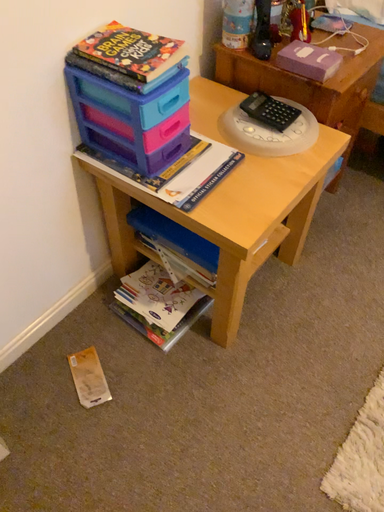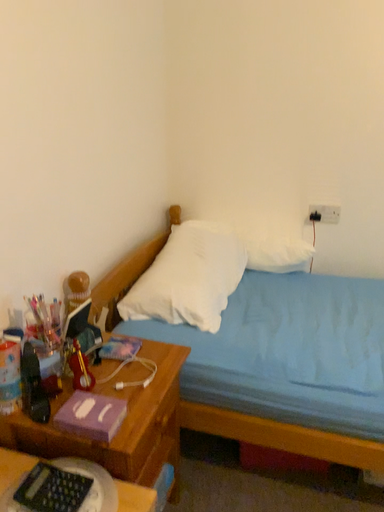
Question: How did the camera likely rotate when shooting the video?

Choices:
 (A) rotated right
 (B) rotated left

Answer: (A)